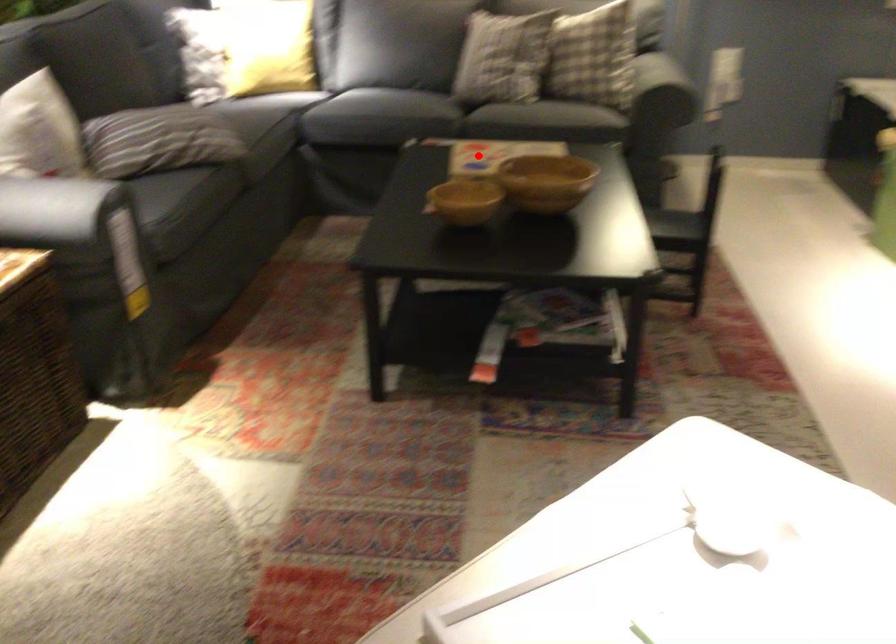
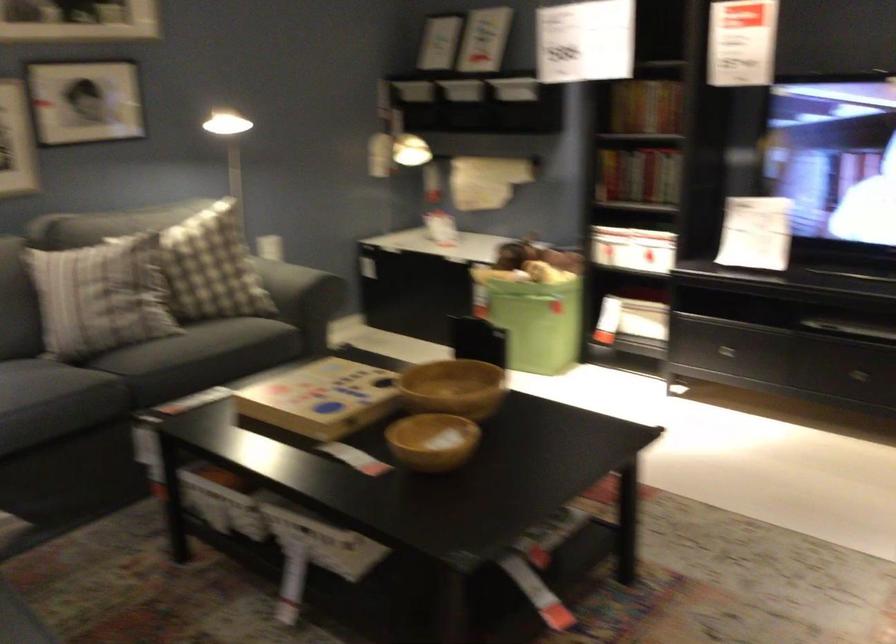
Question: A red point is marked in image1. In image2, is the corresponding 3D point closer to the camera or farther? Reply with the corresponding letter.

Choices:
 (A) The corresponding 3D point is closer.
 (B) The corresponding 3D point is farther.

Answer: (A)